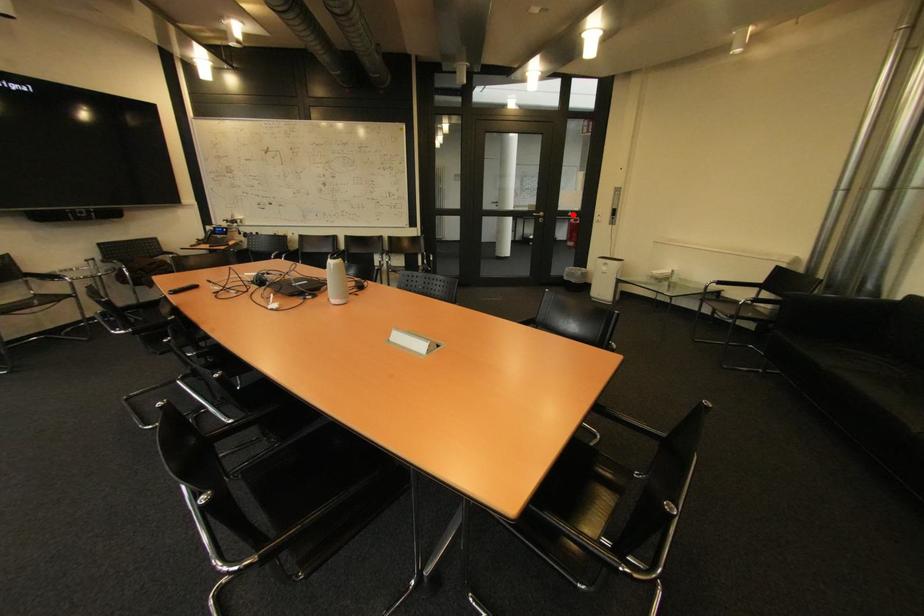
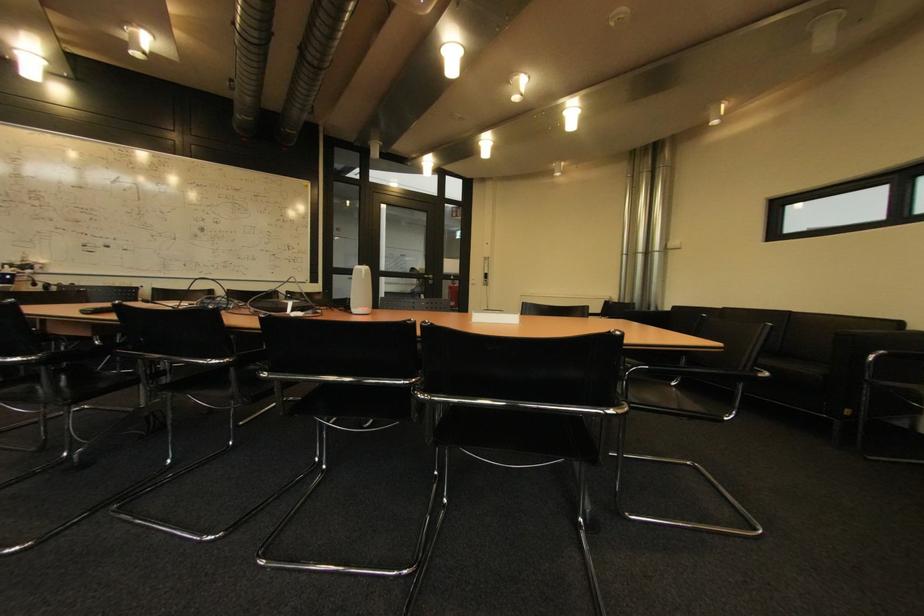
Question: I am providing you with two images of the same scene from different viewpoints. In image1, a red point is highlighted. Considering the same 3D point in image2, which of the following is correct?

Choices:
 (A) It is closer
 (B) It is farther

Answer: (B)